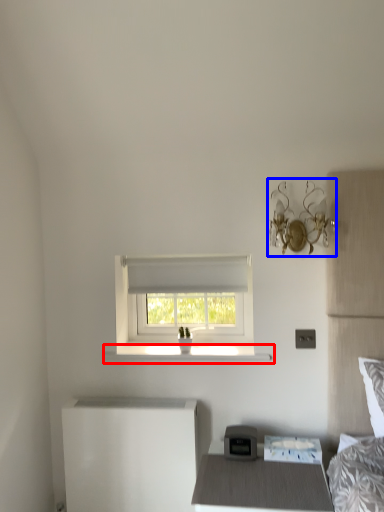
Question: Which of the following is the closest to the observer, window sill (highlighted by a red box) or light fixture (highlighted by a blue box)?

Choices:
 (A) window sill
 (B) light fixture

Answer: (B)